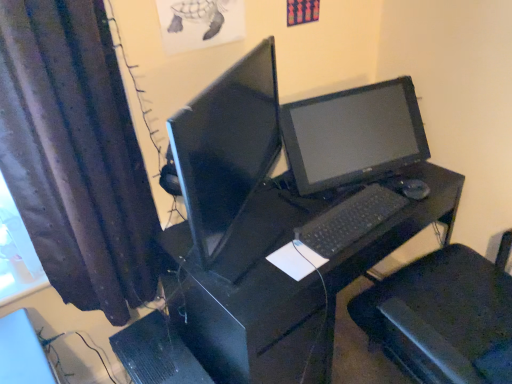
Identify the location of vacant area situated to the left side of black matte keyboard at center. (276, 220).